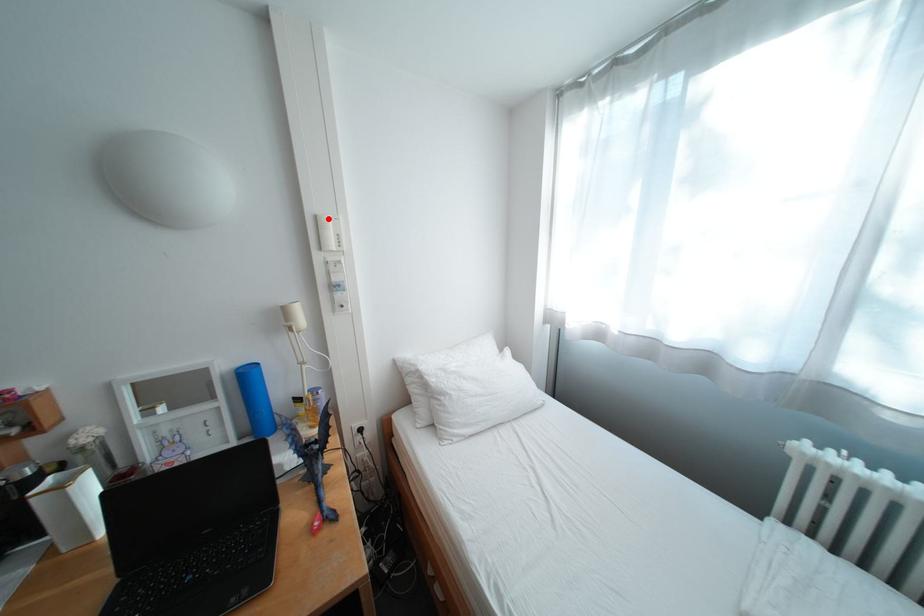
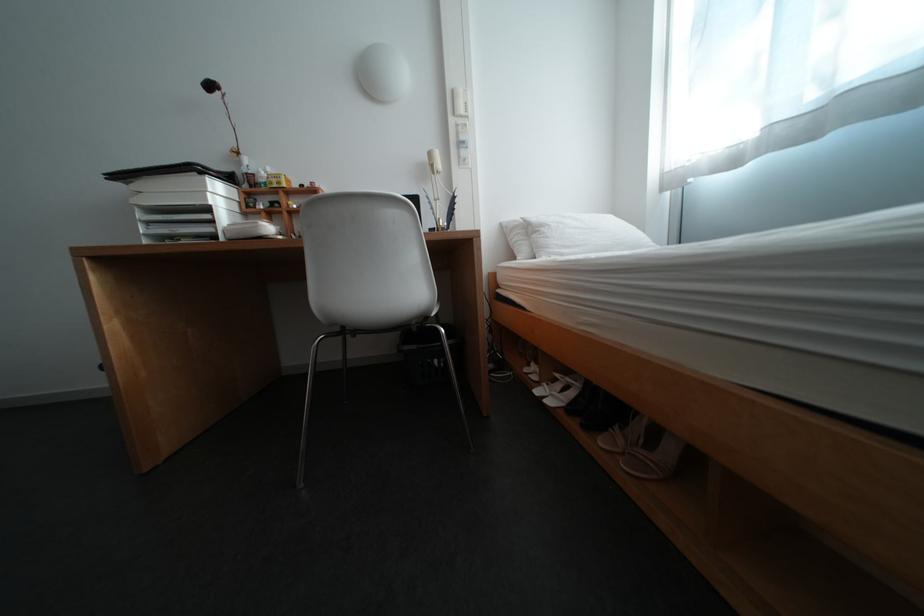
In the second image, find the point that corresponds to the highlighted location in the first image.

(466, 92)